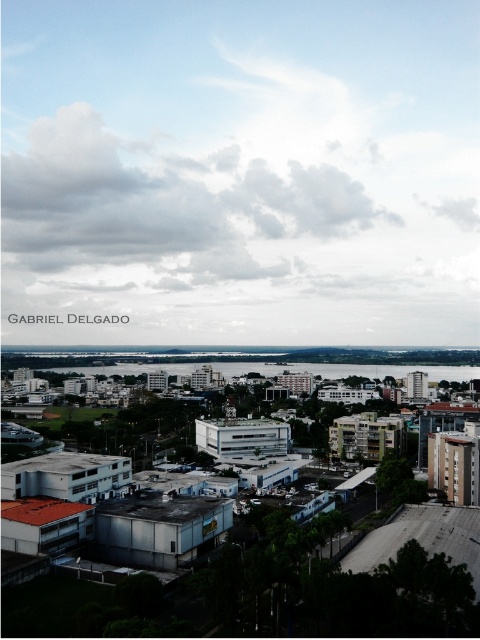
You are a drone operator who needs to fly a drone from the cloudy sky at upper center to the clear water at center. Is the path between them unobstructed?

The cloudy sky at upper center is above the clear water at center, so the path between them is unobstructed as there are no objects mentioned between them in the scene description.